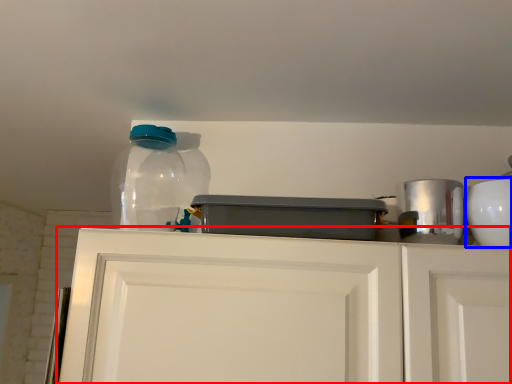
Question: Which object is further to the camera taking this photo, cabinetry (highlighted by a red box) or appliance (highlighted by a blue box)?

Choices:
 (A) cabinetry
 (B) appliance

Answer: (B)